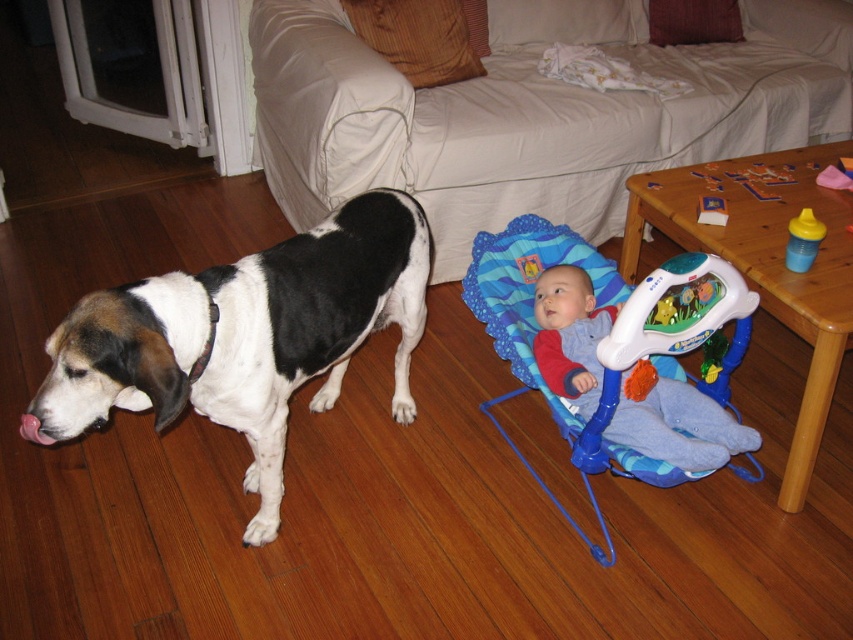
You are a parent trying to choose between placing a new toy either next to the black and white fur at left or near the matte plastic toy at center. Based on their sizes, which object requires more space?

The black and white fur at left requires more space because its width is larger than the matte plastic toy at center.